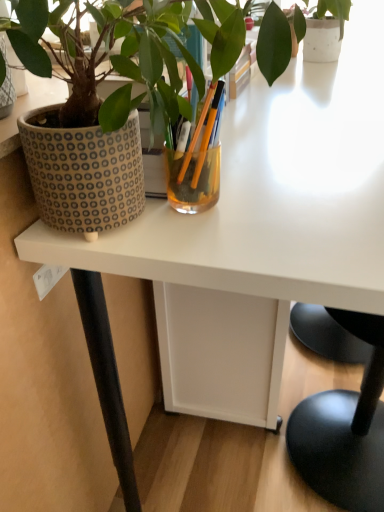
This screenshot has height=512, width=384. Describe the element at coordinates (345, 429) in the screenshot. I see `black plastic chair at lower right` at that location.

Measure the distance between point [335,412] and camera.

Point [335,412] is 4.34 feet away from camera.

Image resolution: width=384 pixels, height=512 pixels. I want to click on black plastic chair at lower right, so click(345, 429).

From the picture: Measure the distance between black plastic chair at lower right and camera.

The distance of black plastic chair at lower right from camera is 31.38 inches.

The height and width of the screenshot is (512, 384). I want to click on black plastic chair at lower right, so click(345, 429).